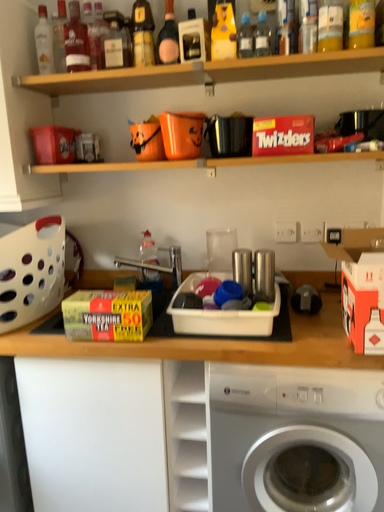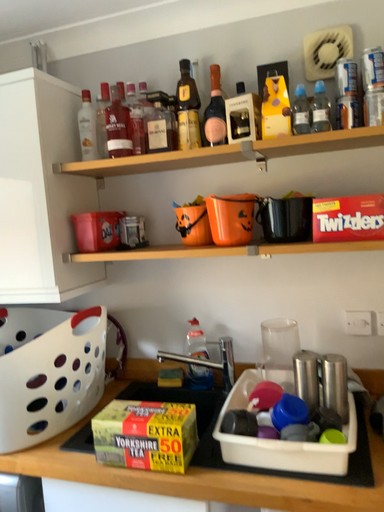
Question: Which way did the camera rotate in the video?

Choices:
 (A) rotated downward
 (B) rotated upward

Answer: (B)